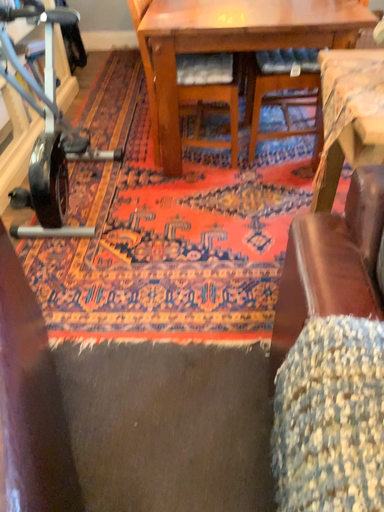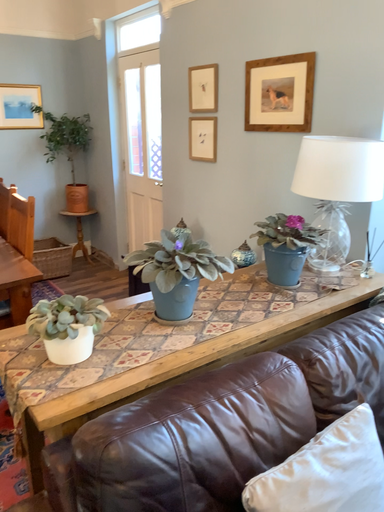
Question: How did the camera likely rotate when shooting the video?

Choices:
 (A) rotated right
 (B) rotated left

Answer: (A)